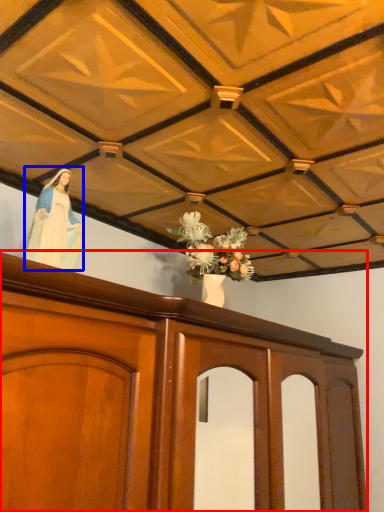
Question: Among these objects, which one is nearest to the camera, furniture (highlighted by a red box) or woman (highlighted by a blue box)?

Choices:
 (A) furniture
 (B) woman

Answer: (A)